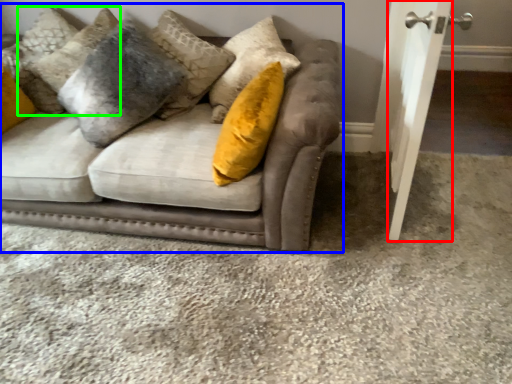
Question: Considering the real-world distances, which object is closest to door (highlighted by a red box)? studio couch (highlighted by a blue box) or pillow (highlighted by a green box).

Choices:
 (A) studio couch
 (B) pillow

Answer: (A)